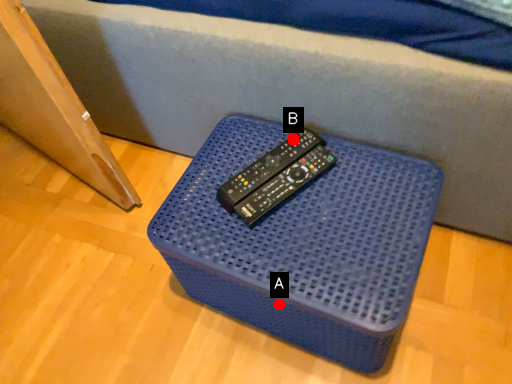
Question: Two points are circled on the image, labeled by A and B beside each circle. Which point appears farthest from the camera in this image?

Choices:
 (A) A is further
 (B) B is further

Answer: (B)